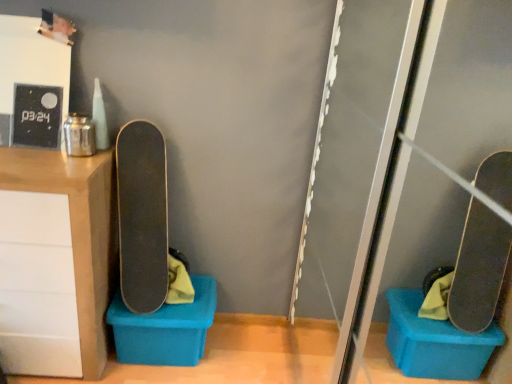
Question: Can you confirm if matte wood cabinet at left is shorter than transparent plastic screen door at right?

Choices:
 (A) yes
 (B) no

Answer: (A)

Question: Is matte wood cabinet at left at the left side of transparent plastic screen door at right?

Choices:
 (A) no
 (B) yes

Answer: (B)

Question: Can you confirm if matte wood cabinet at left is smaller than transparent plastic screen door at right?

Choices:
 (A) no
 (B) yes

Answer: (B)

Question: Is transparent plastic screen door at right located within matte wood cabinet at left?

Choices:
 (A) yes
 (B) no

Answer: (B)

Question: From a real-world perspective, does matte wood cabinet at left stand above transparent plastic screen door at right?

Choices:
 (A) no
 (B) yes

Answer: (A)

Question: From a real-world perspective, does matte wood cabinet at left sit lower than transparent plastic screen door at right?

Choices:
 (A) yes
 (B) no

Answer: (A)

Question: Is smooth black skateboard at center positioned with its back to blue plastic storage box at lower left?

Choices:
 (A) no
 (B) yes

Answer: (A)

Question: Is smooth black skateboard at center in contact with blue plastic storage box at lower left?

Choices:
 (A) no
 (B) yes

Answer: (A)

Question: Is blue plastic storage box at lower left inside smooth black skateboard at center?

Choices:
 (A) yes
 (B) no

Answer: (B)

Question: Can you confirm if smooth black skateboard at center is bigger than blue plastic storage box at lower left?

Choices:
 (A) no
 (B) yes

Answer: (B)

Question: From the image's perspective, would you say smooth black skateboard at center is shown under blue plastic storage box at lower left?

Choices:
 (A) yes
 (B) no

Answer: (B)

Question: Does smooth black skateboard at center have a greater height compared to blue plastic storage box at lower left?

Choices:
 (A) yes
 (B) no

Answer: (A)

Question: From a real-world perspective, is matte wood cabinet at left physically below blue plastic storage box at lower left?

Choices:
 (A) yes
 (B) no

Answer: (B)